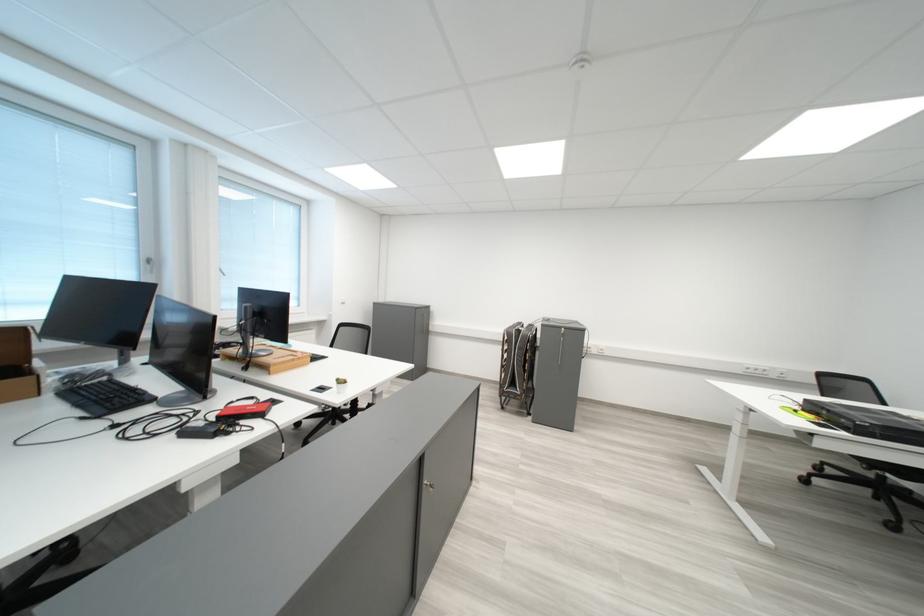
Where is `small potted plant`? The height and width of the screenshot is (616, 924). small potted plant is located at coordinates (341, 384).